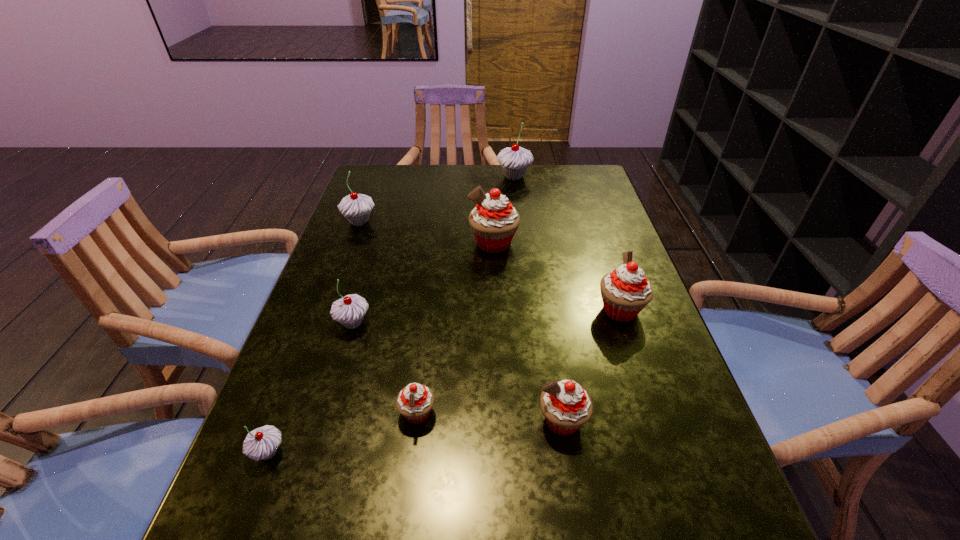
At what (x,y) coordinates should I click in order to perform the action: click on the biggest gray cupcake. Please return your answer as a coordinate pair (x, y). The image size is (960, 540). Looking at the image, I should click on (515, 160).

The image size is (960, 540). Identify the location of the farthest gray cupcake. (515, 160).

The height and width of the screenshot is (540, 960). Find the location of `the farthest pink cupcake`. the farthest pink cupcake is located at coordinates (494, 221).

This screenshot has height=540, width=960. Identify the location of the third nearest gray cupcake. (355, 207).

Find the location of a particular element. The height and width of the screenshot is (540, 960). the third nearest pink cupcake is located at coordinates (625, 292).

Locate an element on the screen. the second biggest pink cupcake is located at coordinates (625, 292).

Identify the location of the third farthest gray cupcake. (349, 311).

Find the location of `the third biggest pink cupcake`. the third biggest pink cupcake is located at coordinates (566, 406).

Identify the location of the nearest gray cupcake. (260, 444).

At what (x,y) coordinates should I click in order to perform the action: click on the leftmost pink cupcake. Please return your answer as a coordinate pair (x, y). The height and width of the screenshot is (540, 960). Looking at the image, I should click on (415, 401).